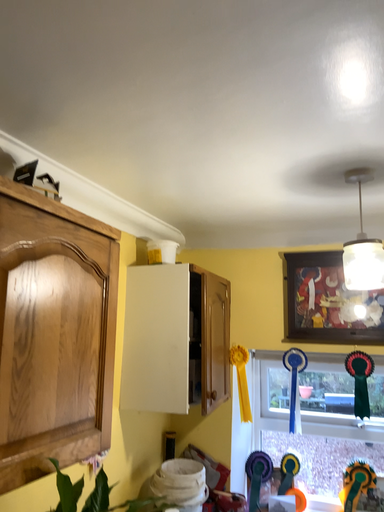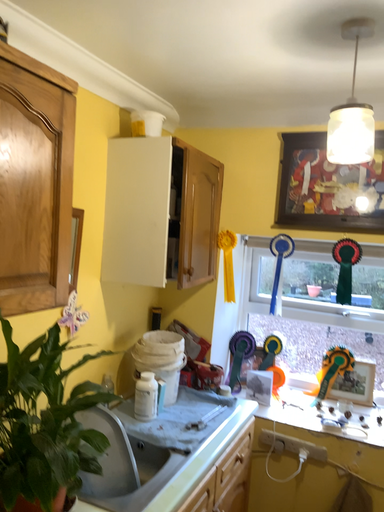
Question: How did the camera likely rotate when shooting the video?

Choices:
 (A) rotated upward
 (B) rotated downward

Answer: (B)